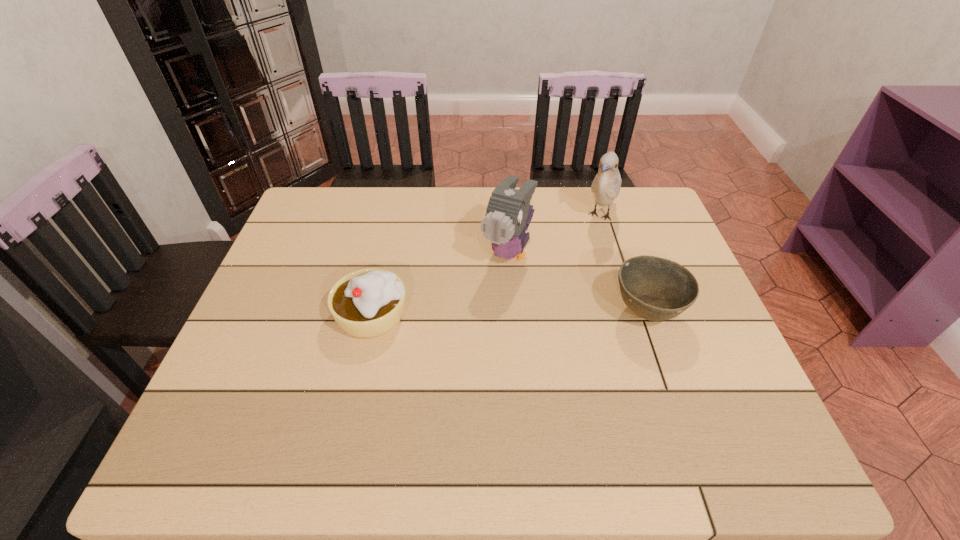
The image size is (960, 540). What are the coordinates of `the leftmost object` in the screenshot? It's located at (369, 302).

Find the location of a particular element. This screenshot has height=540, width=960. bowl is located at coordinates (656, 289).

Find the location of a particular element. The image size is (960, 540). the right bird is located at coordinates (606, 185).

Where is `the left bird`? the left bird is located at coordinates (508, 210).

In order to click on vacant space positioned on the right of the leftmost object in this screenshot , I will do coord(502,315).

The width and height of the screenshot is (960, 540). I want to click on vacant space situated 0.070m on the front of the bowl, so click(665, 367).

Locate an element on the screen. This screenshot has height=540, width=960. vacant space situated at the beak of the right bird is located at coordinates (589, 249).

I want to click on vacant space located 0.380m at the beak of the right bird, so click(551, 322).

This screenshot has height=540, width=960. I want to click on free region located 0.080m at the beak of the right bird, so click(x=589, y=249).

The image size is (960, 540). What are the coordinates of `vacant space located at the beak of the left bird` in the screenshot? It's located at (476, 318).